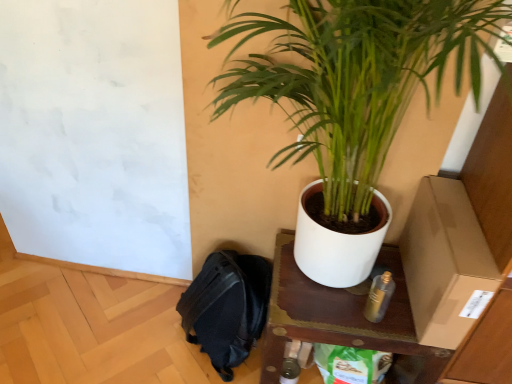
Question: Does green glossy plant at upper right appear on the left side of brown cardboard box at right?

Choices:
 (A) no
 (B) yes

Answer: (B)

Question: Considering the relative positions of green glossy plant at upper right and brown cardboard box at right in the image provided, is green glossy plant at upper right in front of brown cardboard box at right?

Choices:
 (A) no
 (B) yes

Answer: (B)

Question: Would you say brown cardboard box at right is part of green glossy plant at upper right's contents?

Choices:
 (A) no
 (B) yes

Answer: (A)

Question: Considering the relative sizes of green glossy plant at upper right and brown cardboard box at right in the image provided, is green glossy plant at upper right taller than brown cardboard box at right?

Choices:
 (A) no
 (B) yes

Answer: (B)

Question: Is green glossy plant at upper right aimed at brown cardboard box at right?

Choices:
 (A) no
 (B) yes

Answer: (B)

Question: Considering the positions of green glossy plant at upper right and metallic gold spray can at lower right in the image, is green glossy plant at upper right wider or thinner than metallic gold spray can at lower right?

Choices:
 (A) thin
 (B) wide

Answer: (B)

Question: Considering the positions of green glossy plant at upper right and metallic gold spray can at lower right in the image, is green glossy plant at upper right bigger or smaller than metallic gold spray can at lower right?

Choices:
 (A) big
 (B) small

Answer: (A)

Question: Is point (473, 33) closer or farther from the camera than point (368, 309)?

Choices:
 (A) closer
 (B) farther

Answer: (A)

Question: From the image's perspective, relative to metallic gold spray can at lower right, is green glossy plant at upper right above or below?

Choices:
 (A) above
 (B) below

Answer: (A)

Question: Is point (218, 274) positioned closer to the camera than point (448, 236)?

Choices:
 (A) closer
 (B) farther

Answer: (B)

Question: Which is correct: black fabric backpack at lower left is inside brown cardboard box at right, or outside of it?

Choices:
 (A) outside
 (B) inside

Answer: (A)

Question: Is black fabric backpack at lower left wider or thinner than brown cardboard box at right?

Choices:
 (A) wide
 (B) thin

Answer: (B)

Question: From the image's perspective, relative to brown cardboard box at right, is black fabric backpack at lower left above or below?

Choices:
 (A) below
 (B) above

Answer: (A)

Question: From a real-world perspective, relative to brown cardboard box at right, is wooden table at center vertically above or below?

Choices:
 (A) above
 (B) below

Answer: (B)

Question: Is point (425, 382) closer or farther from the camera than point (438, 332)?

Choices:
 (A) farther
 (B) closer

Answer: (A)